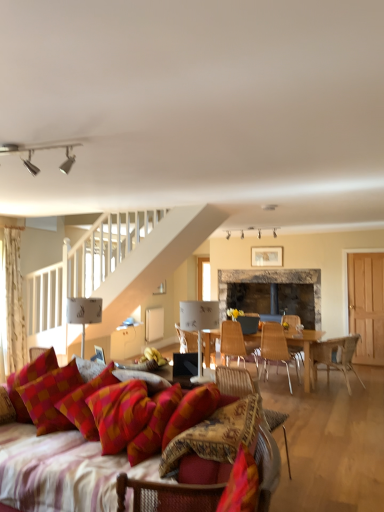
Find the location of a particular element. free location to the right of patterned fabric chair at center, acting as the second chair starting from the front is located at coordinates (334, 487).